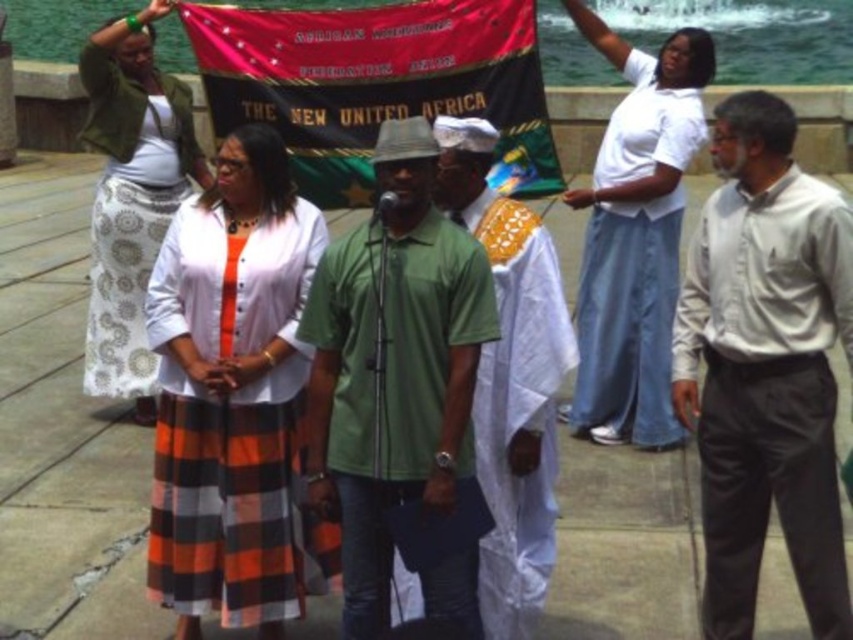
Question: Which object is closer to the camera taking this photo?

Choices:
 (A) white cotton skirt at upper left
 (B) white cotton shirt at upper right
 (C) green cotton shirt at center
 (D) green matte shirt at center

Answer: (D)

Question: Which of the following is the farthest from the observer?

Choices:
 (A) (816, 228)
 (B) (175, 128)
 (C) (460, 376)

Answer: (B)

Question: Which point is closer to the camera?

Choices:
 (A) red fabric banner at center
 (B) white cotton shirt at upper right
 (C) green cotton shirt at center

Answer: (C)

Question: Is orange plaid skirt at center to the right of red fabric banner at center from the viewer's perspective?

Choices:
 (A) yes
 (B) no

Answer: (B)

Question: Is gray cotton shirt at right closer to the viewer compared to green cotton shirt at center?

Choices:
 (A) no
 (B) yes

Answer: (B)

Question: Is red fabric banner at center to the left of white cotton skirt at upper left from the viewer's perspective?

Choices:
 (A) yes
 (B) no

Answer: (B)